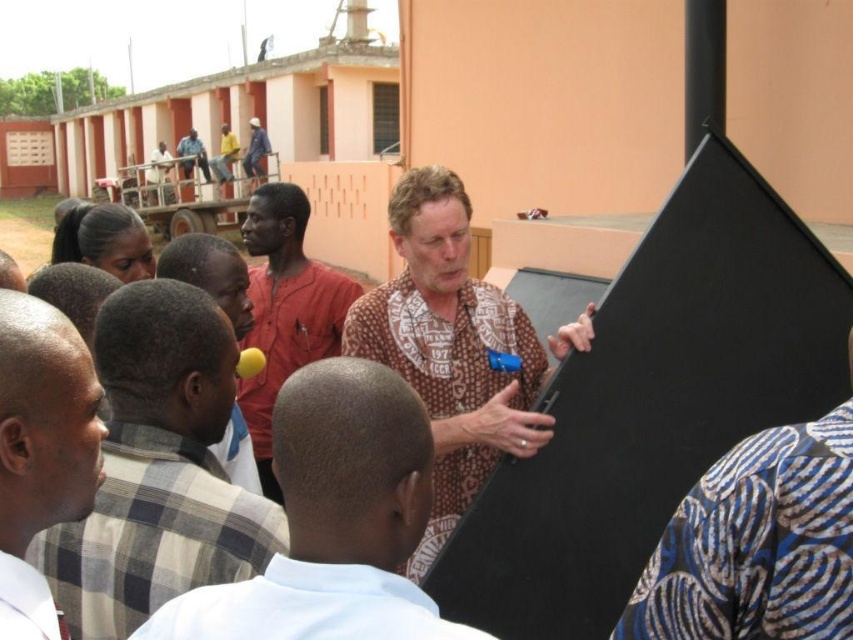
Can you confirm if blue fabric shirt at upper center is positioned to the right of blue denim shirt at upper left?

Yes, blue fabric shirt at upper center is to the right of blue denim shirt at upper left.

Is point (248, 145) in front of point (202, 156)?

Yes, point (248, 145) is closer to viewer.

Is point (257, 129) positioned before point (201, 148)?

Yes, point (257, 129) is closer to viewer.

Identify the location of blue fabric shirt at upper center. The width and height of the screenshot is (853, 640). (256, 154).

Who is shorter, matte red shirt at center or light brown fabric shirt at center?

light brown fabric shirt at center

Is matte red shirt at center wider than light brown fabric shirt at center?

Yes, matte red shirt at center is wider than light brown fabric shirt at center.

Which is behind, point (270, 310) or point (219, 289)?

Positioned behind is point (270, 310).

Locate an element on the screen. matte red shirt at center is located at coordinates (285, 308).

Does white checkered shirt at left have a lesser height compared to brown printed shirt at center?

Correct, white checkered shirt at left is not as tall as brown printed shirt at center.

Does point (122, 316) come behind point (428, 369)?

No, (122, 316) is in front of (428, 369).

The height and width of the screenshot is (640, 853). I want to click on white checkered shirt at left, so click(160, 468).